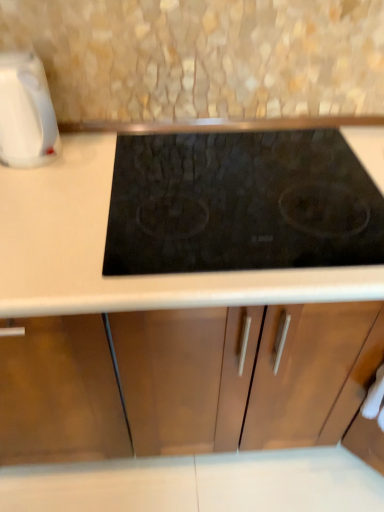
Question: Is black glass cooktop at center bigger than white glossy kettle at left?

Choices:
 (A) yes
 (B) no

Answer: (A)

Question: Is the surface of black glass cooktop at center in direct contact with white glossy kettle at left?

Choices:
 (A) no
 (B) yes

Answer: (A)

Question: Can you confirm if black glass cooktop at center is positioned to the left of white glossy kettle at left?

Choices:
 (A) yes
 (B) no

Answer: (B)

Question: Is black glass cooktop at center taller than white glossy kettle at left?

Choices:
 (A) no
 (B) yes

Answer: (A)

Question: Does black glass cooktop at center appear on the right side of white glossy kettle at left?

Choices:
 (A) yes
 (B) no

Answer: (A)

Question: Is black glass cooktop at center far away from white glossy kettle at left?

Choices:
 (A) yes
 (B) no

Answer: (B)

Question: Is white glossy kettle at left bigger than black glass cooktop at center?

Choices:
 (A) no
 (B) yes

Answer: (A)

Question: Would you consider white glossy kettle at left to be distant from black glass cooktop at center?

Choices:
 (A) yes
 (B) no

Answer: (B)

Question: From a real-world perspective, is white glossy kettle at left located beneath black glass cooktop at center?

Choices:
 (A) no
 (B) yes

Answer: (A)

Question: Does white glossy kettle at left come behind black glass cooktop at center?

Choices:
 (A) yes
 (B) no

Answer: (A)

Question: Does white glossy kettle at left have a greater height compared to black glass cooktop at center?

Choices:
 (A) yes
 (B) no

Answer: (A)

Question: Does white glossy kettle at left appear on the left side of black glass cooktop at center?

Choices:
 (A) yes
 (B) no

Answer: (A)

Question: Considering the positions of white glossy kettle at left and black glass cooktop at center in the image, is white glossy kettle at left taller or shorter than black glass cooktop at center?

Choices:
 (A) tall
 (B) short

Answer: (A)